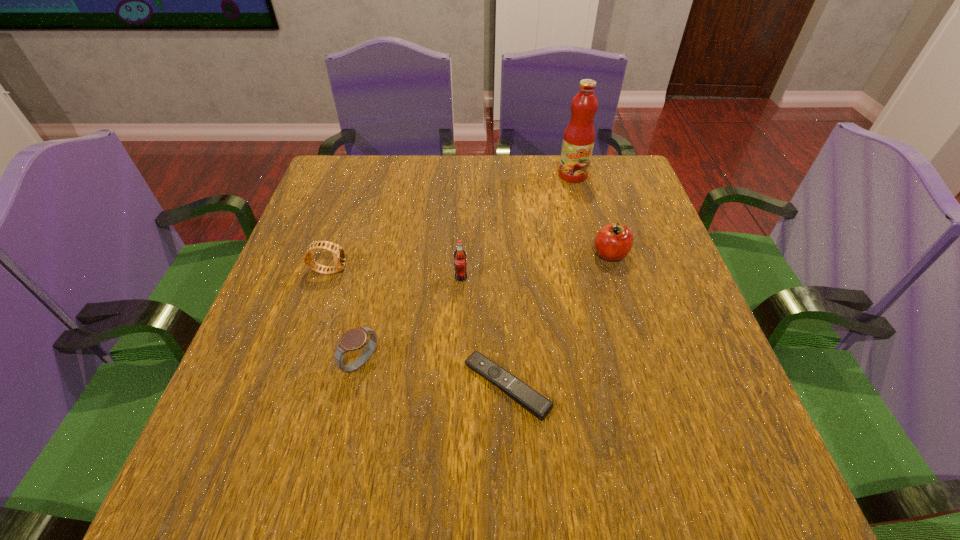
Where is `vacant region at the far edge of the desktop`? This screenshot has width=960, height=540. vacant region at the far edge of the desktop is located at coordinates (543, 157).

In the image, there is a desktop. Find the location of `free region at the left edge`. free region at the left edge is located at coordinates (344, 274).

This screenshot has height=540, width=960. What are the coordinates of `free space at the right edge of the desktop` in the screenshot? It's located at (729, 428).

Where is `vacant space at the near left corner of the desktop`? The height and width of the screenshot is (540, 960). vacant space at the near left corner of the desktop is located at coordinates (215, 479).

In the image, there is a desktop. In order to click on vacant space at the far right corner in this screenshot , I will do `click(591, 164)`.

At what (x,y) coordinates should I click in order to perform the action: click on vacant space at the near right corner of the desktop. Please return your answer as a coordinate pair (x, y). The height and width of the screenshot is (540, 960). Looking at the image, I should click on (713, 451).

This screenshot has height=540, width=960. I want to click on free point between the shortest object and the second tallest object, so click(484, 332).

Locate an element on the screen. free space between the farthest object and the nearer watch is located at coordinates (467, 269).

The width and height of the screenshot is (960, 540). In order to click on vacant space that is in between the remote control and the farthest object in this screenshot , I will do `click(540, 280)`.

Locate an element on the screen. Image resolution: width=960 pixels, height=540 pixels. empty location between the soda bottle and the apple is located at coordinates (536, 266).